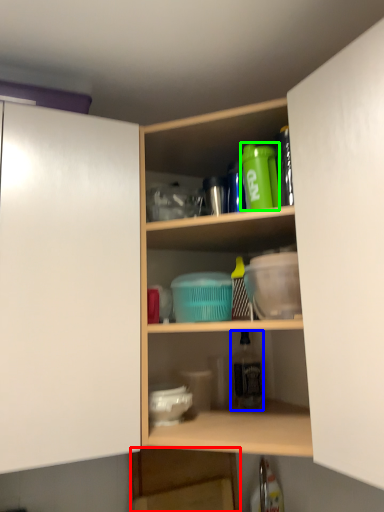
Question: Estimate the real-world distances between objects in this image. Which object is closer to shelf (highlighted by a red box), bottle (highlighted by a blue box) or bottle (highlighted by a green box)?

Choices:
 (A) bottle
 (B) bottle

Answer: (A)